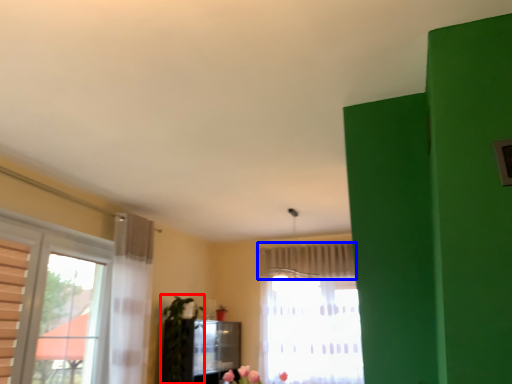
Question: Which point is further to the camera, plant (highlighted by a red box) or curtain (highlighted by a blue box)?

Choices:
 (A) plant
 (B) curtain

Answer: (B)